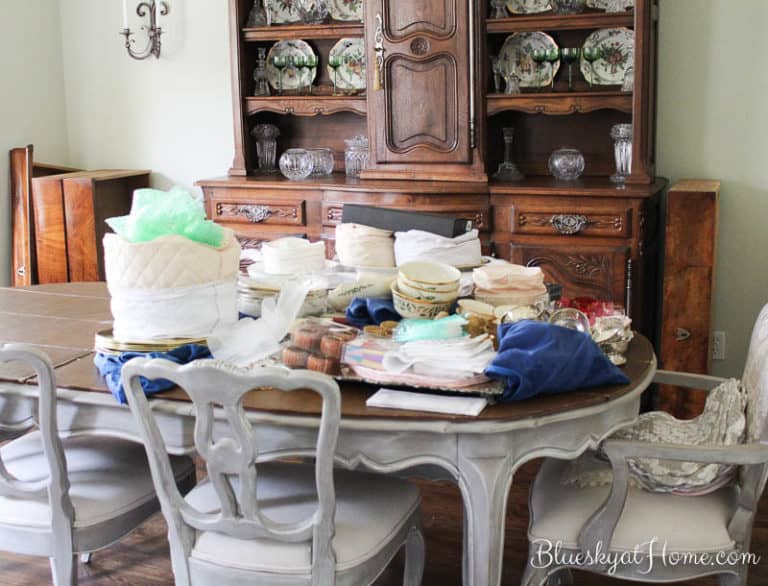
This screenshot has width=768, height=586. Find the location of `chair cushions`. chair cushions is located at coordinates (111, 482), (240, 548), (677, 514).